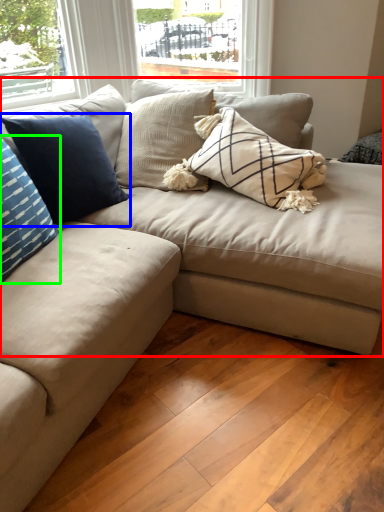
Question: Considering the real-world distances, which object is closest to studio couch (highlighted by a red box)? pillow (highlighted by a blue box) or pillow (highlighted by a green box).

Choices:
 (A) pillow
 (B) pillow

Answer: (A)